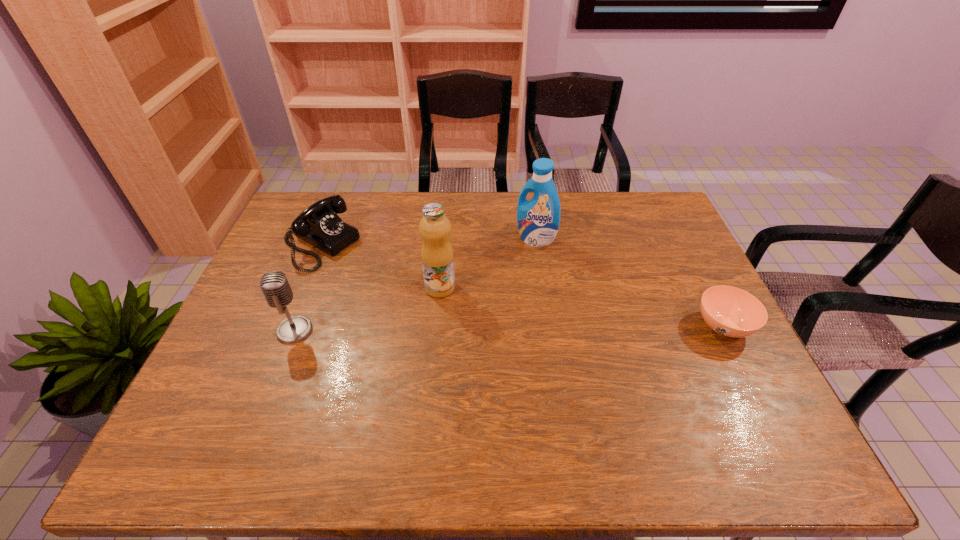
Identify the location of free space between the fruit juice and the shortest object. Image resolution: width=960 pixels, height=540 pixels. (582, 307).

The width and height of the screenshot is (960, 540). Identify the location of free space that is in between the third shortest object and the telephone. (307, 288).

Find the location of a particular element. The height and width of the screenshot is (540, 960). vacant region between the microphone and the fruit juice is located at coordinates (368, 309).

This screenshot has width=960, height=540. I want to click on vacant space in between the fourth object from left to right and the third farthest object, so click(488, 264).

In order to click on free space that is in between the detergent and the rightmost object in this screenshot , I will do `click(630, 282)`.

Locate an element on the screen. empty location between the third object from right to left and the fourth object from left to right is located at coordinates (488, 264).

Locate an element on the screen. free space between the soup bowl and the second object from right to left is located at coordinates (630, 282).

The width and height of the screenshot is (960, 540). Identify the location of free spot between the third farthest object and the third shortest object. (x=368, y=309).

The image size is (960, 540). Find the location of `free space between the third shortest object and the third object from left to right`. free space between the third shortest object and the third object from left to right is located at coordinates (368, 309).

At what (x,y) coordinates should I click in order to perform the action: click on object that is the fourth closest to the microphone. Please return your answer as a coordinate pair (x, y). Looking at the image, I should click on (732, 312).